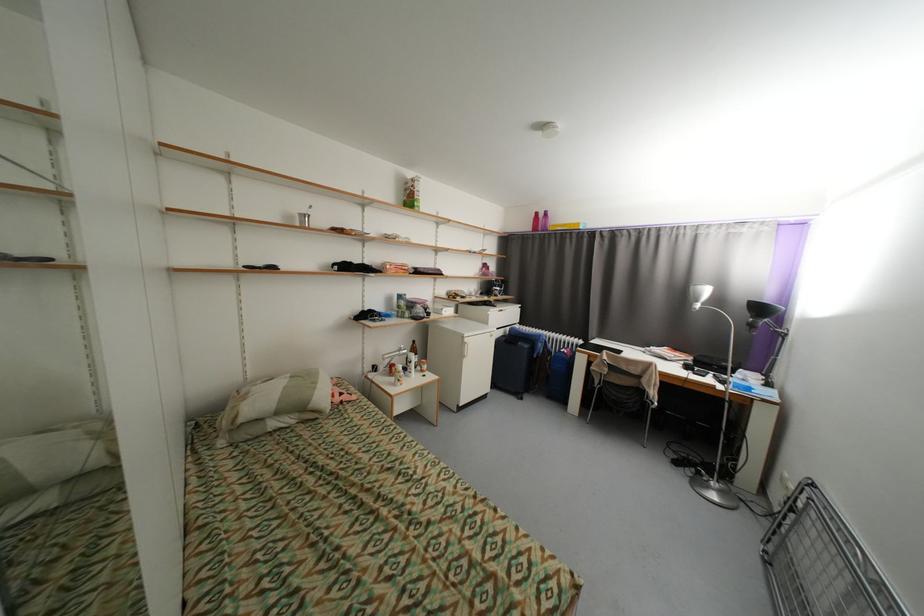
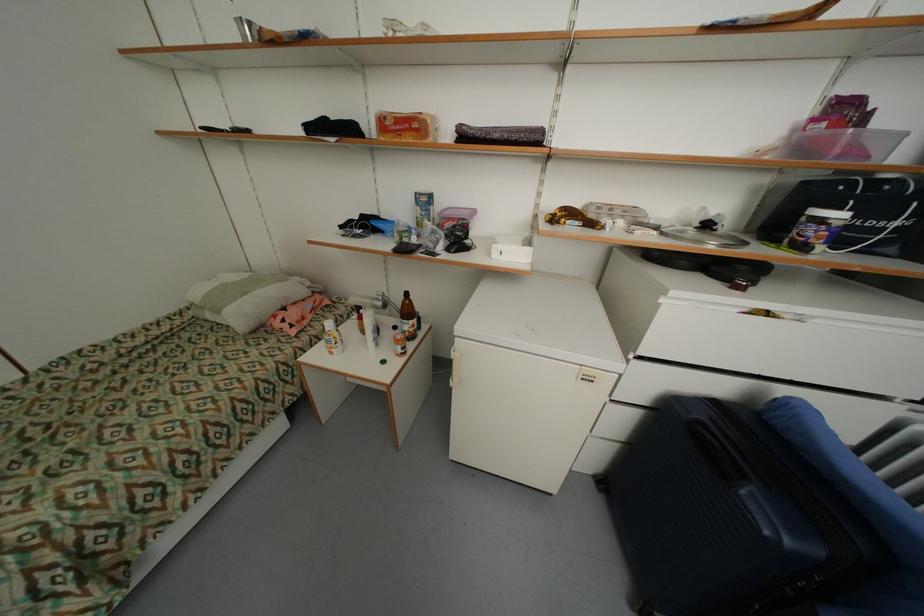
Find the pixel in the second image that matches (450,314) in the first image.

(502, 256)